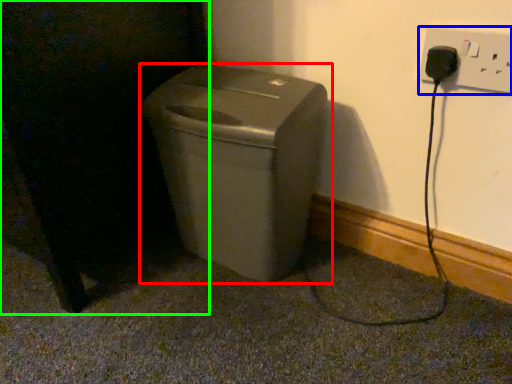
Question: Considering the real-world distances, which object is farthest from waste container (highlighted by a red box)? electric outlet (highlighted by a blue box) or dark (highlighted by a green box)?

Choices:
 (A) electric outlet
 (B) dark

Answer: (A)